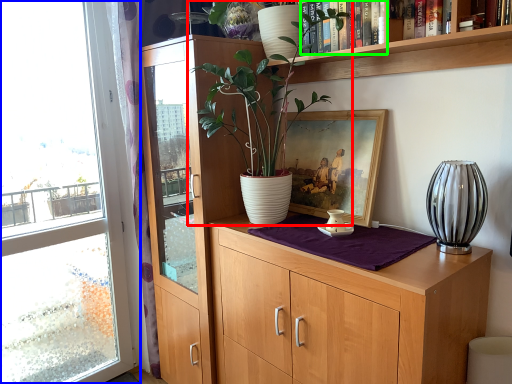
Question: Considering the real-world distances, which object is closest to houseplant (highlighted by a red box)? window (highlighted by a blue box) or book (highlighted by a green box).

Choices:
 (A) window
 (B) book

Answer: (B)